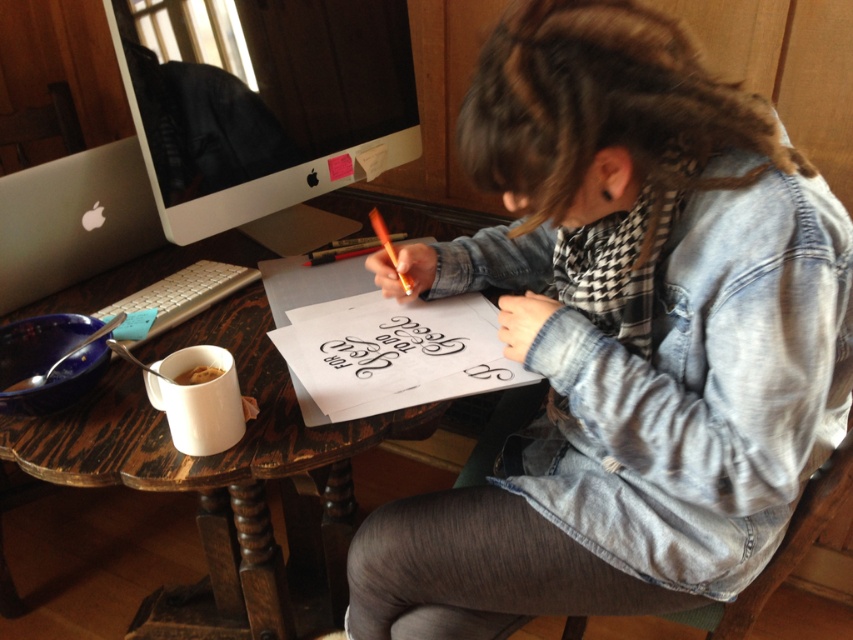
In the scene shown: Between denim jacket at center and smooth orange crayon at center, which one appears on the right side from the viewer's perspective?

Positioned to the right is denim jacket at center.

Is denim jacket at center further to the viewer compared to smooth orange crayon at center?

No, it is not.

At what (x,y) coordinates should I click in order to perform the action: click on denim jacket at center. Please return your answer as a coordinate pair (x, y). Looking at the image, I should click on (622, 337).

Does denim jacket at center appear on the left side of white glossy computer monitor at upper left?

No, denim jacket at center is not to the left of white glossy computer monitor at upper left.

Looking at this image, between denim jacket at center and white glossy computer monitor at upper left, which one appears on the left side from the viewer's perspective?

white glossy computer monitor at upper left is more to the left.

Who is more distant from viewer, (643, 241) or (334, 44)?

Point (334, 44)

Where is `denim jacket at center`? Image resolution: width=853 pixels, height=640 pixels. denim jacket at center is located at coordinates (622, 337).

Based on the photo, between white glossy computer monitor at upper left and black calligraphy at center, which one is positioned higher?

white glossy computer monitor at upper left is above.

The image size is (853, 640). What do you see at coordinates (265, 104) in the screenshot?
I see `white glossy computer monitor at upper left` at bounding box center [265, 104].

Locate an element on the screen. white glossy computer monitor at upper left is located at coordinates (265, 104).

What are the coordinates of `white glossy computer monitor at upper left` in the screenshot? It's located at (265, 104).